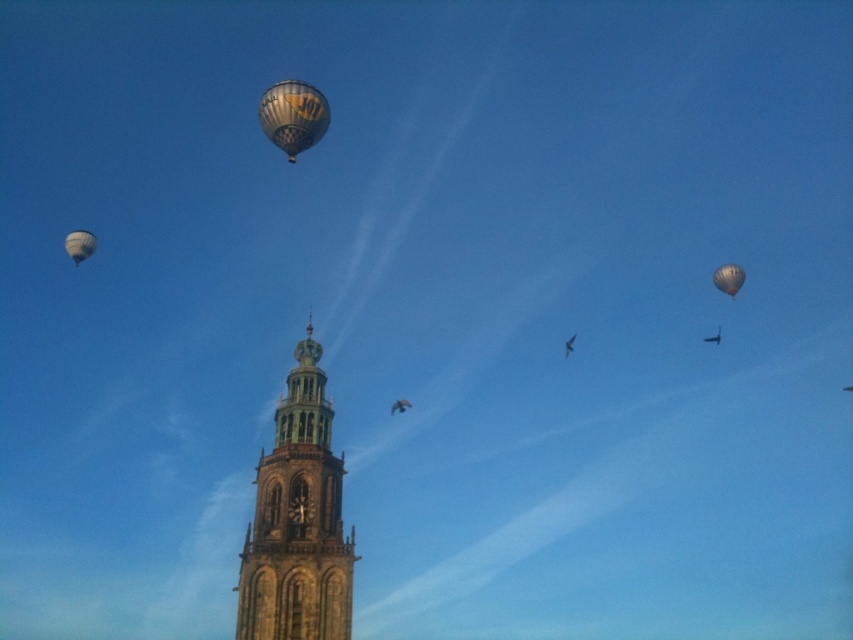
Which of these two, stone clock tower at center or matte black balloon at upper right, stands taller?

stone clock tower at center is taller.

Where is `stone clock tower at center`? stone clock tower at center is located at coordinates (297, 522).

Where is `stone clock tower at center`? The width and height of the screenshot is (853, 640). stone clock tower at center is located at coordinates (297, 522).

Between point (259, 586) and point (271, 141), which one is positioned in front?

Point (259, 586) is more forward.

Does stone clock tower at center appear on the left side of checkered fabric balloon at upper center?

Incorrect, stone clock tower at center is not on the left side of checkered fabric balloon at upper center.

Does point (277, 548) lie behind point (306, 100)?

No, it is in front of (306, 100).

Identify the location of stone clock tower at center. The width and height of the screenshot is (853, 640). (297, 522).

Find the location of a particular element. checkered fabric balloon at upper center is located at coordinates (293, 115).

Consider the image. Who is taller, checkered fabric balloon at upper center or matte black balloon at upper right?

With more height is checkered fabric balloon at upper center.

Is point (276, 90) closer to viewer compared to point (741, 284)?

Yes.

You are a GUI agent. You are given a task and a screenshot of the screen. Output one action in this format:
    pyautogui.click(x=<x>, y=<y>)
    Task: Click on the checkered fabric balloon at upper center
    
    Given the screenshot: What is the action you would take?
    click(293, 115)